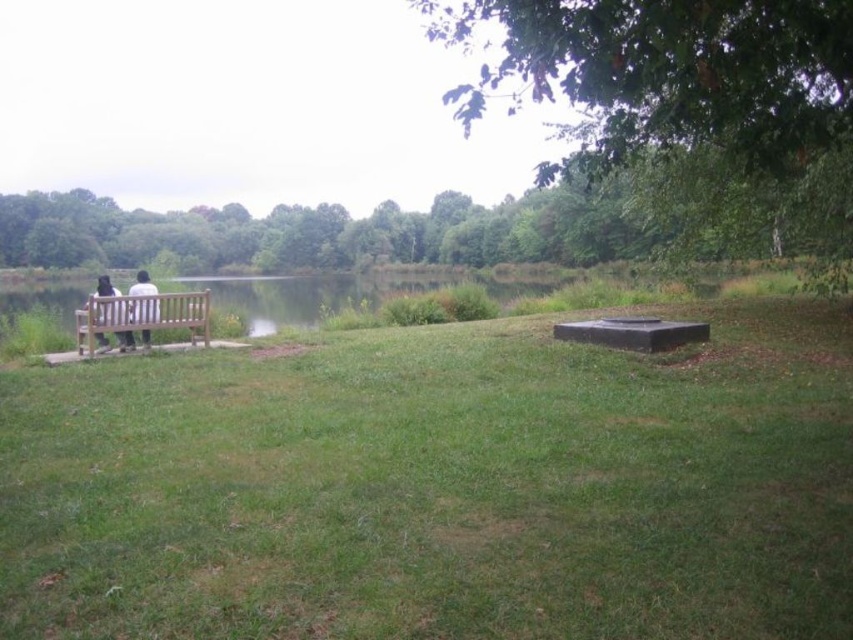
You are a photographer trying to capture a landscape shot of the green leafy tree at upper center and the white fabric shirt at left. Which object should you focus on first if you want to ensure both are in sharp focus?

The green leafy tree at upper center is wider than the white fabric shirt at left, so you should focus on the wider object first to maximize depth of field and ensure both are in focus.

You are standing in the outdoor scene and want to take a photo of the white fabric shirt at left without including the green leafy tree at upper center in the frame. Which direction should you move to achieve this?

Move to the right side of the white fabric shirt at left so that the green leafy tree at upper center is no longer in the frame.